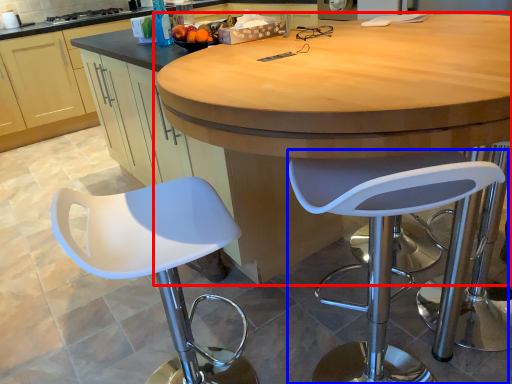
Question: Which of the following is the closest to the observer, table (highlighted by a red box) or chair (highlighted by a blue box)?

Choices:
 (A) table
 (B) chair

Answer: (A)